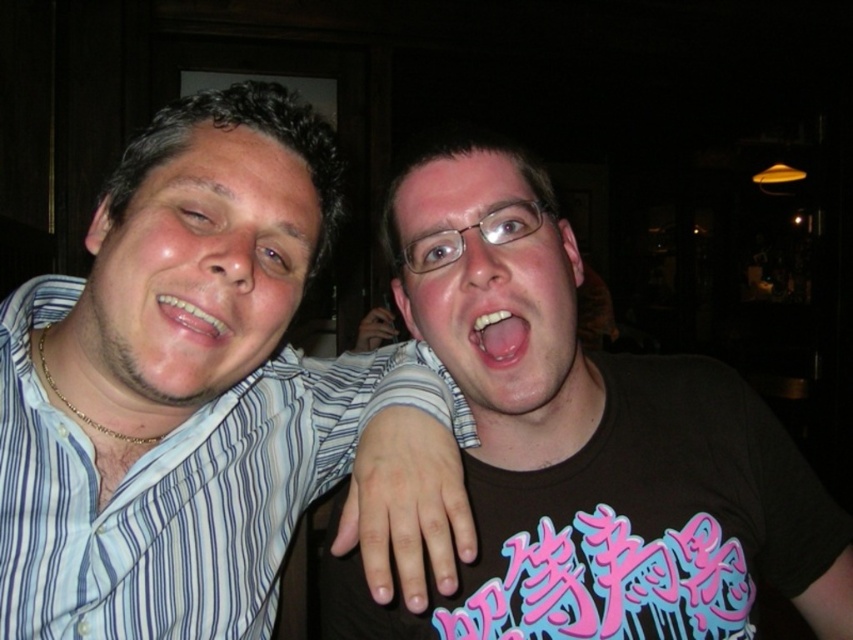
You are trying to take a photo of the blue striped shirt at left and the pink glossy mouth at center. Which object is wider in the image?

The blue striped shirt at left is wider than the pink glossy mouth at center according to the description.

You are standing in front of the image and want to locate the blue striped shirt at left. What are the coordinates of its position?

The coordinates of the blue striped shirt at left are at point (180, 486).

You are taking a photo of two friends at a party. You notice the blue striped shirt at left and the matte black face at center. Which object should you focus on first to ensure both are in frame?

The blue striped shirt at left is positioned under matte black face at center, so focusing on the matte black face at center first will help ensure both are in frame since it is higher up.